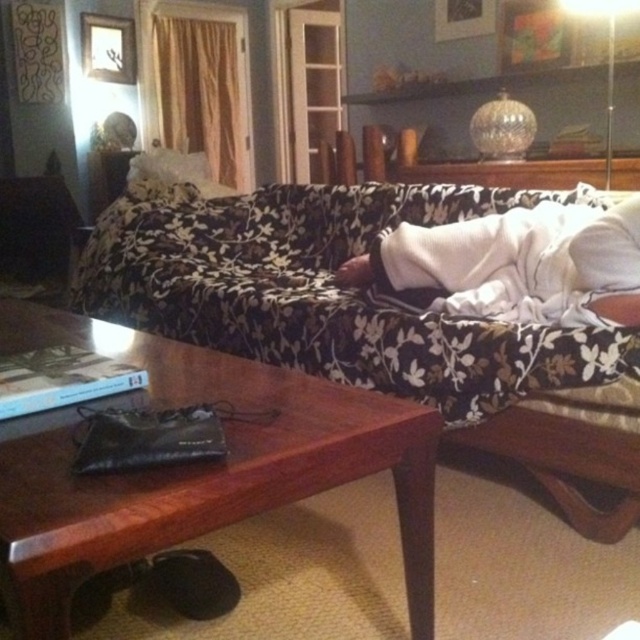
You are organizing a cozy reading corner in the living room. You have a white soft blanket at center and a white soft pillow at upper right. Which item would you choose to cover yourself with if you want something larger?

The white soft blanket at center is bigger than the white soft pillow at upper right, so you should choose the white soft blanket at center to cover yourself.